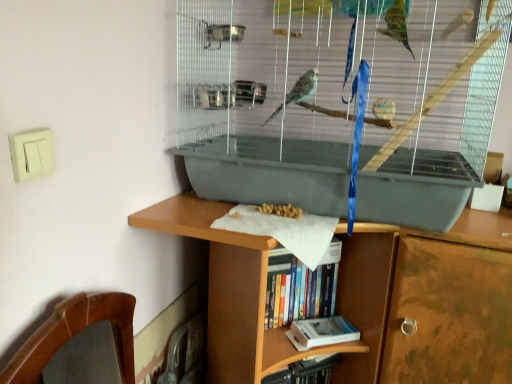
Question: In which direction should I rotate to look at hardcover book at center, the second book positioned from the bottom?

Choices:
 (A) left
 (B) right

Answer: (B)

Question: Can you confirm if gray plastic birdcage at center is positioned to the left of hardcover book at lower center, the first book when ordered from bottom to top?

Choices:
 (A) no
 (B) yes

Answer: (A)

Question: Is gray plastic birdcage at center taller than hardcover book at lower center, the first book when ordered from bottom to top?

Choices:
 (A) no
 (B) yes

Answer: (B)

Question: Is hardcover book at lower center, the first book when ordered from bottom to top, surrounded by gray plastic birdcage at center?

Choices:
 (A) yes
 (B) no

Answer: (B)

Question: Is gray plastic birdcage at center beside hardcover book at lower center, the first book when ordered from bottom to top?

Choices:
 (A) yes
 (B) no

Answer: (B)

Question: Could you tell me if gray plastic birdcage at center is turned towards hardcover book at lower center, positioned as the 2th book in top-to-bottom order?

Choices:
 (A) yes
 (B) no

Answer: (B)

Question: Can you confirm if gray plastic birdcage at center is bigger than hardcover book at lower center, the first book when ordered from bottom to top?

Choices:
 (A) no
 (B) yes

Answer: (B)

Question: Can you confirm if gray plastic birdcage at center is taller than hardcover book at center, which is counted as the 1th book, starting from the top?

Choices:
 (A) yes
 (B) no

Answer: (A)

Question: Considering the relative positions of gray plastic birdcage at center and hardcover book at center, the second book positioned from the bottom, in the image provided, is gray plastic birdcage at center to the left of hardcover book at center, the second book positioned from the bottom, from the viewer's perspective?

Choices:
 (A) no
 (B) yes

Answer: (A)

Question: Is gray plastic birdcage at center bigger than hardcover book at center, the second book positioned from the bottom?

Choices:
 (A) yes
 (B) no

Answer: (A)

Question: Is gray plastic birdcage at center not inside hardcover book at center, the second book positioned from the bottom?

Choices:
 (A) no
 (B) yes

Answer: (B)

Question: Is gray plastic birdcage at center oriented away from hardcover book at center, which is counted as the 1th book, starting from the top?

Choices:
 (A) yes
 (B) no

Answer: (B)

Question: Is gray plastic birdcage at center far from hardcover book at center, which is counted as the 1th book, starting from the top?

Choices:
 (A) no
 (B) yes

Answer: (A)

Question: Is hardcover book at lower center, the first book when ordered from bottom to top, turned away from hardcover book at center, which is counted as the 1th book, starting from the top?

Choices:
 (A) no
 (B) yes

Answer: (A)